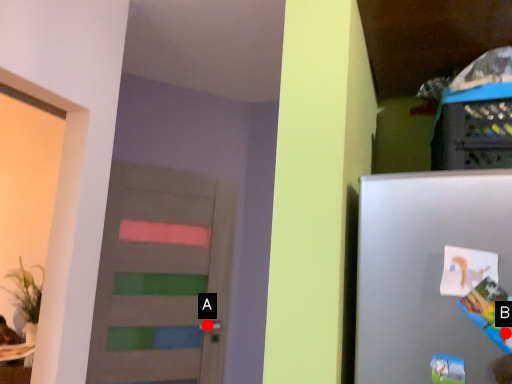
Question: Two points are circled on the image, labeled by A and B beside each circle. Among these points, which one is farthest from the camera?

Choices:
 (A) A is further
 (B) B is further

Answer: (A)